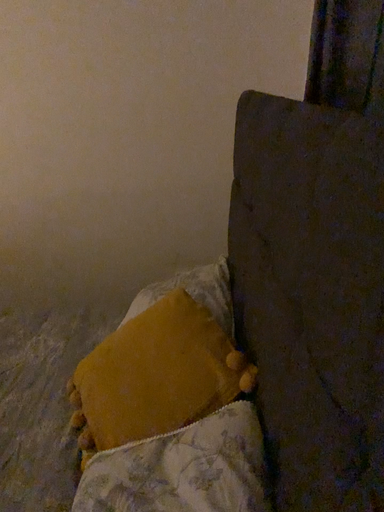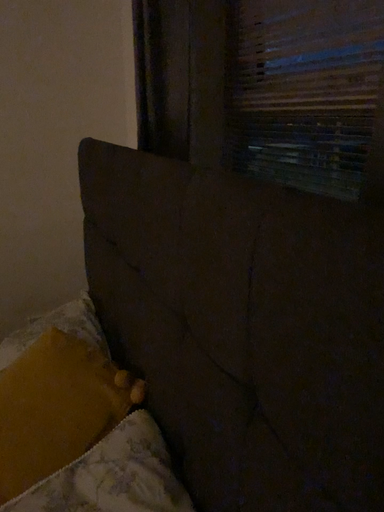
Question: Which way did the camera rotate in the video?

Choices:
 (A) rotated left
 (B) rotated right

Answer: (B)